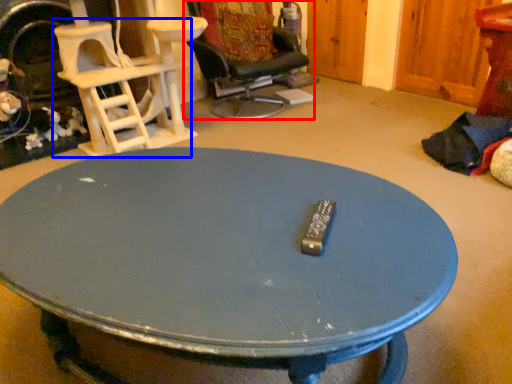
Question: Which object is closer to the camera taking this photo, chair (highlighted by a red box) or chair (highlighted by a blue box)?

Choices:
 (A) chair
 (B) chair

Answer: (B)